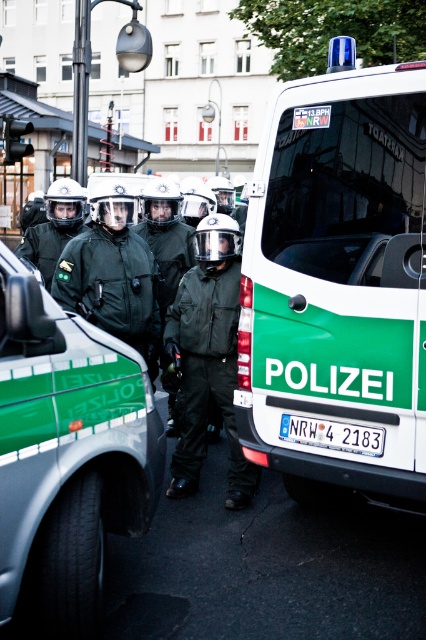
Question: Which point is closer to the camera?

Choices:
 (A) (2, 394)
 (B) (302, 442)
 (C) (213, 243)
 (D) (399, 198)

Answer: (A)

Question: Does green matte van at center appear over matte black uniform at center?

Choices:
 (A) no
 (B) yes

Answer: (B)

Question: Which point is farther from the camera taking this photo?

Choices:
 (A) (290, 259)
 (B) (370, 451)

Answer: (A)

Question: Can you confirm if green matte uniform at center is positioned below matte black helmet at center?

Choices:
 (A) yes
 (B) no

Answer: (A)

Question: Can you confirm if green matte van at center is positioned to the right of matte black uniform at center?

Choices:
 (A) yes
 (B) no

Answer: (A)

Question: Among these points, which one is nearest to the camera?

Choices:
 (A) (359, 435)
 (B) (354, 51)

Answer: (A)